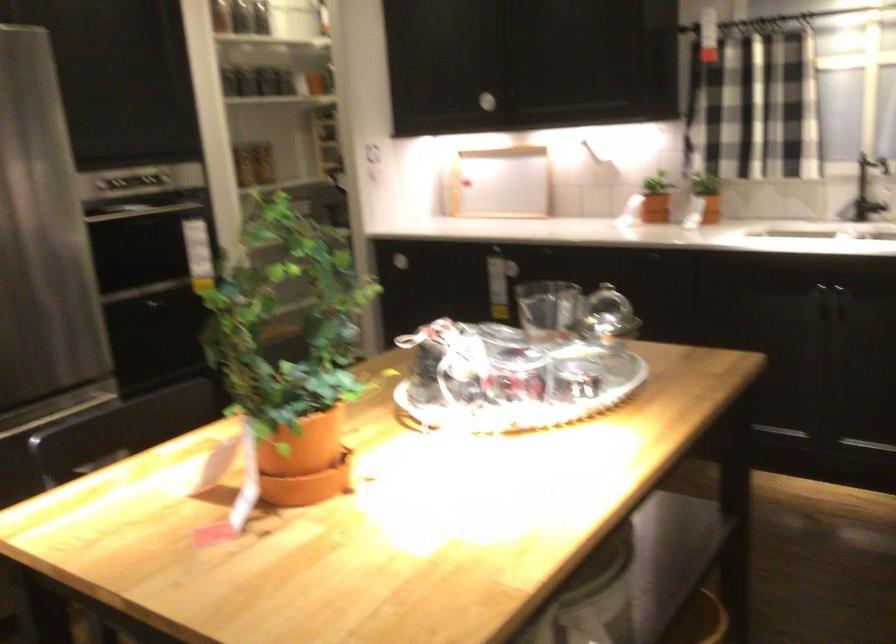
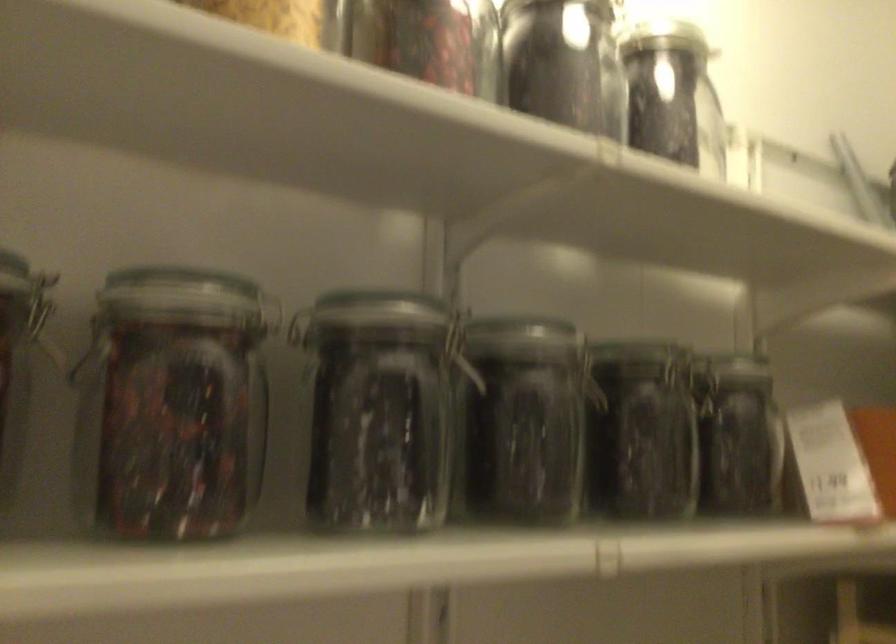
Locate, in the second image, the point that corresponds to point (224, 69) in the first image.

(376, 410)